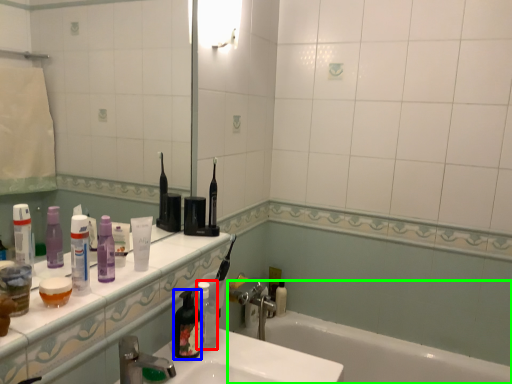
Question: Estimate the real-world distances between objects in this image. Which object is farther from toiletry (highlighted by a red box), toiletry (highlighted by a blue box) or bathtub (highlighted by a green box)?

Choices:
 (A) toiletry
 (B) bathtub

Answer: (B)